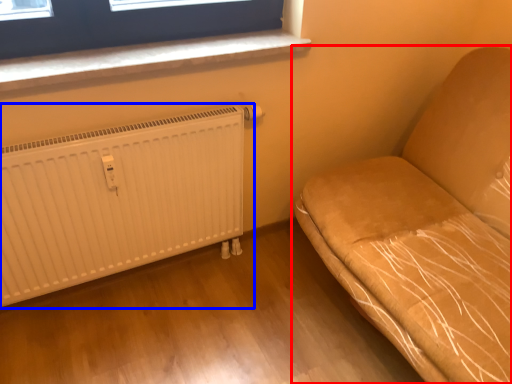
Question: Which object is closer to the camera taking this photo, furniture (highlighted by a red box) or radiator (highlighted by a blue box)?

Choices:
 (A) furniture
 (B) radiator

Answer: (A)